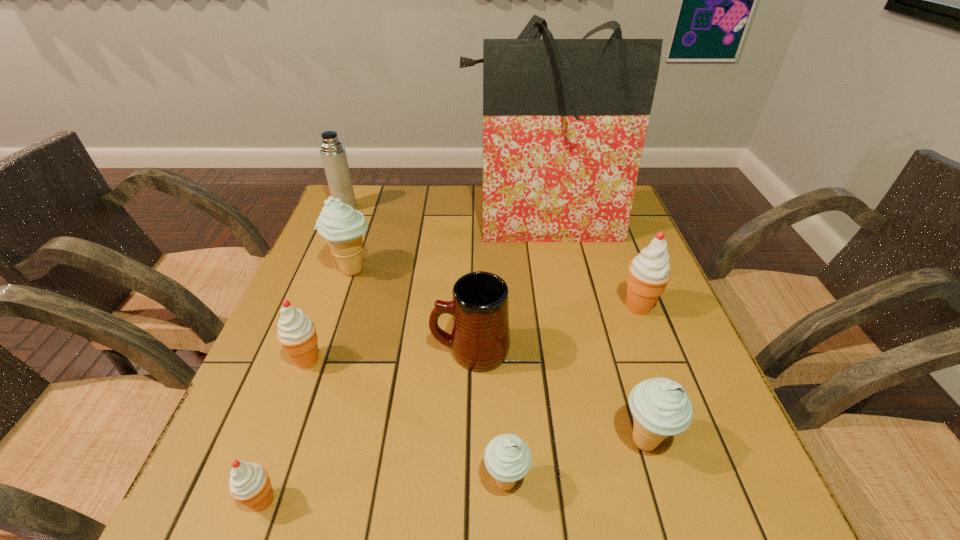
This screenshot has width=960, height=540. I want to click on object situated at the near left corner, so click(249, 483).

Identify the location of object that is at the far right corner. (564, 120).

In the image, there is a desktop. At what (x,y) coordinates should I click in order to perform the action: click on free space at the far edge. Please return your answer as a coordinate pair (x, y). The height and width of the screenshot is (540, 960). Looking at the image, I should click on (397, 188).

The height and width of the screenshot is (540, 960). I want to click on free region at the near edge of the desktop, so click(426, 489).

I want to click on vacant space at the left edge of the desktop, so click(303, 286).

I want to click on vacant space at the right edge of the desktop, so click(x=602, y=298).

Image resolution: width=960 pixels, height=540 pixels. I want to click on vacant space that's between the thermos bottle and the fourth icecream from left to right, so click(426, 345).

This screenshot has width=960, height=540. I want to click on vacant point located between the smallest beige icecream and the farthest red icecream, so click(x=572, y=394).

Find the location of a particular element. The image size is (960, 540). vacant space in between the second farthest icecream and the nearest red icecream is located at coordinates (450, 403).

At what (x,y) coordinates should I click in order to perform the action: click on unoccupied area between the thermos bottle and the second smallest red icecream. Please return your answer as a coordinate pair (x, y). Looking at the image, I should click on (326, 284).